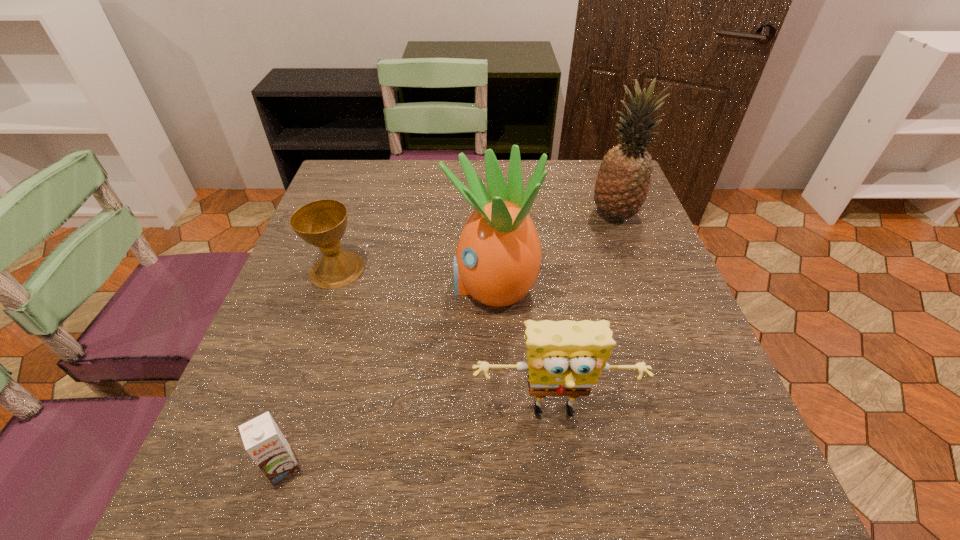
Where is `sponge present at the right edge`? This screenshot has width=960, height=540. sponge present at the right edge is located at coordinates (565, 358).

Identify the location of object that is at the near left corner. (263, 440).

At what (x,y) coordinates should I click in order to perform the action: click on object present at the far right corner. Please return your answer as a coordinate pair (x, y). Image resolution: width=960 pixels, height=540 pixels. Looking at the image, I should click on (622, 185).

I want to click on vacant space at the far edge of the desktop, so click(430, 207).

Identify the location of vacant space at the near edge. Image resolution: width=960 pixels, height=540 pixels. (461, 517).

This screenshot has width=960, height=540. I want to click on vacant area at the left edge, so click(284, 358).

At what (x,y) coordinates should I click in order to perform the action: click on free space at the right edge of the desktop. Please return your answer as a coordinate pair (x, y). This screenshot has height=540, width=960. Looking at the image, I should click on (657, 294).

Locate an element on the screen. The image size is (960, 540). free space at the far left corner is located at coordinates (331, 183).

I want to click on vacant area at the near right corner, so click(672, 519).

What are the coordinates of `free spot between the nearer pineapple and the second shortest object` in the screenshot? It's located at pos(415,278).